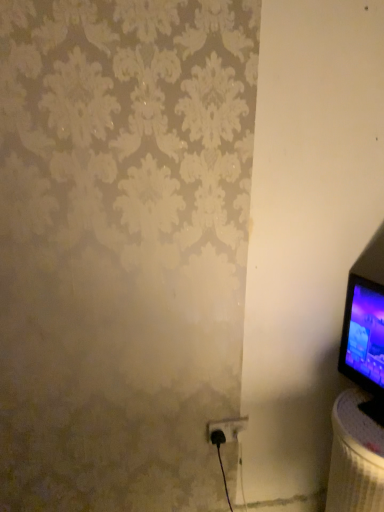
Question: Looking at their shapes, would you say black plastic power plug at lower right is wider or thinner than white textured table at lower right?

Choices:
 (A) wide
 (B) thin

Answer: (B)

Question: Considering their positions, is black plastic power plug at lower right located in front of or behind white textured table at lower right?

Choices:
 (A) behind
 (B) front

Answer: (A)

Question: From a real-world perspective, relative to white textured table at lower right, is black plastic power plug at lower right vertically above or below?

Choices:
 (A) above
 (B) below

Answer: (A)

Question: From a real-world perspective, is white textured table at lower right above or below black plastic power plug at lower right?

Choices:
 (A) below
 (B) above

Answer: (A)

Question: Is white textured table at lower right wider or thinner than black plastic power plug at lower right?

Choices:
 (A) wide
 (B) thin

Answer: (A)

Question: Is white textured table at lower right in front of or behind black plastic power plug at lower right in the image?

Choices:
 (A) behind
 (B) front

Answer: (B)

Question: Would you say white textured table at lower right is inside or outside black plastic power plug at lower right?

Choices:
 (A) outside
 (B) inside

Answer: (A)